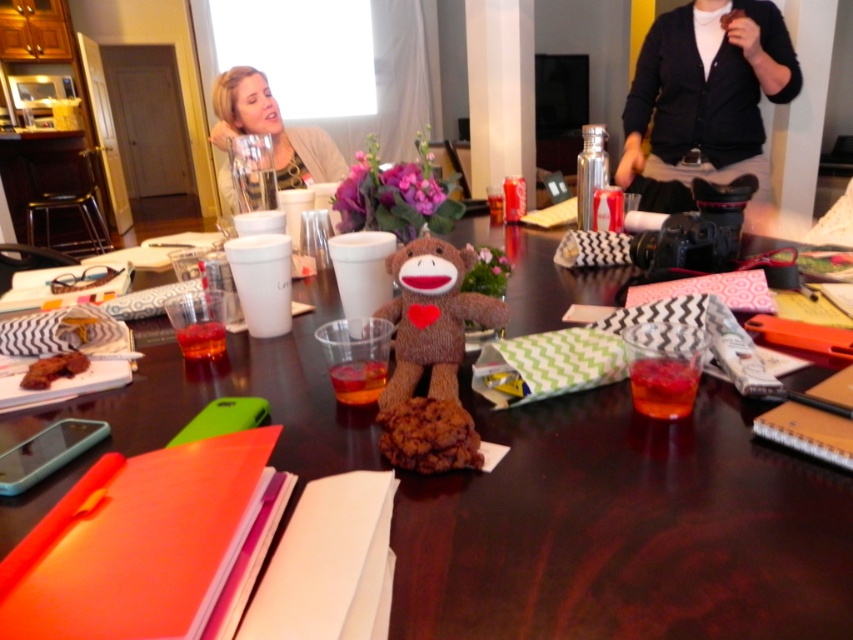
Question: Where is matte beige sweater at upper left located in relation to baked chocolate cookie at center in the image?

Choices:
 (A) below
 (B) above

Answer: (B)

Question: Is brown fabric table at center positioned in front of baked chocolate cookie at center?

Choices:
 (A) no
 (B) yes

Answer: (B)

Question: Can you confirm if black cardigan at upper right is positioned below baked chocolate cookie at center?

Choices:
 (A) no
 (B) yes

Answer: (A)

Question: Among these points, which one is farthest from the camera?

Choices:
 (A) (581, 557)
 (B) (32, 371)

Answer: (B)

Question: Which point appears closest to the camera in this image?

Choices:
 (A) (409, 484)
 (B) (300, 138)
 (C) (791, 80)

Answer: (A)

Question: Estimate the real-world distances between objects in this image. Which object is closer to the baked chocolate cookie at center?

Choices:
 (A) brown fabric table at center
 (B) brown plush sock monkey at center
 (C) black cardigan at upper right
 (D) matte beige sweater at upper left

Answer: (A)